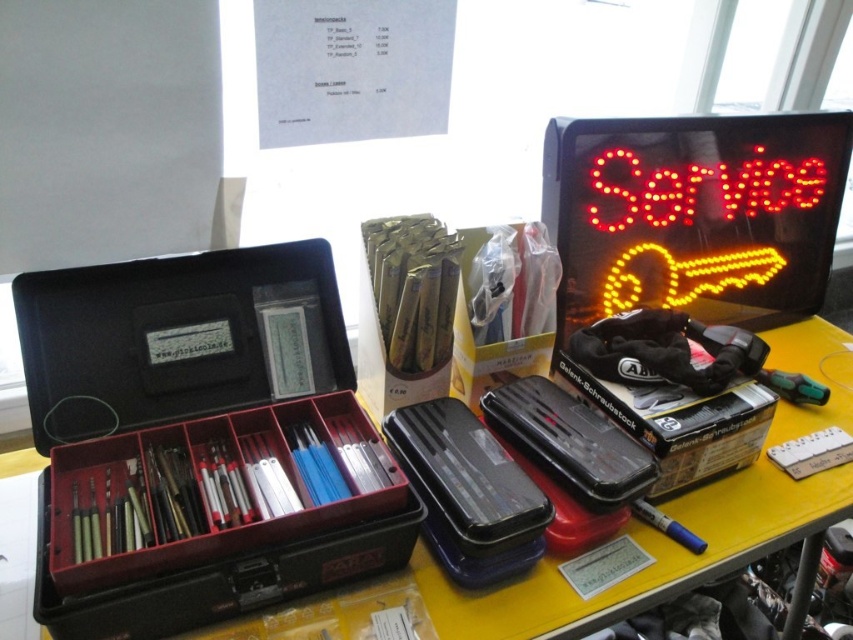
You are a technician who needs to place a 12 inch long tool on the workspace. You see the black plastic toolbox at center and the yellow matte table at center. Can you fit the tool between them?

The distance between the black plastic toolbox at center and the yellow matte table at center is 10.62 inches. Since the tool is 12 inches long, it cannot fit in the space between them.

You are a technician who needs to reach a point that is 88.68 centimeters away from you. You see the point marked as point (256, 483) in your workspace. Can you safely reach this point without moving your chair?

The distance of point (256, 483) from viewer is 88.68 centimeters. Since the point is within your typical reaching distance, you can safely reach it without moving your chair.

You are a technician needing to access the black plastic toolbox at center. From your current position at the left side of the workspace, which direction should you move to reach it?

The black plastic toolbox at center is located at point [196,440], so you should move towards the center of the workspace to reach it.